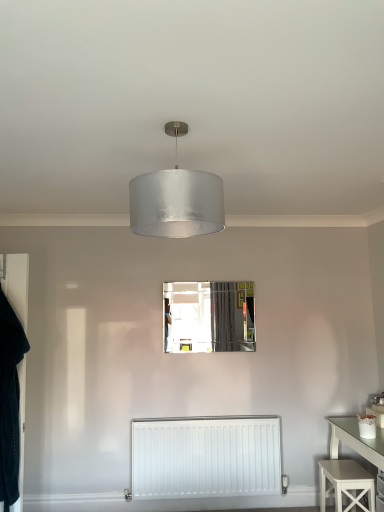
Question: Would you say white painted wood stool at lower right contains clear glass mirror at center?

Choices:
 (A) no
 (B) yes

Answer: (A)

Question: Is white painted wood stool at lower right oriented towards clear glass mirror at center?

Choices:
 (A) no
 (B) yes

Answer: (A)

Question: Would you say white painted wood stool at lower right is a long distance from clear glass mirror at center?

Choices:
 (A) yes
 (B) no

Answer: (A)

Question: Can you confirm if white painted wood stool at lower right is taller than clear glass mirror at center?

Choices:
 (A) yes
 (B) no

Answer: (B)

Question: From the image's perspective, is white painted wood stool at lower right below clear glass mirror at center?

Choices:
 (A) yes
 (B) no

Answer: (A)

Question: Considering the positions of clear glass mirror at center and satin silver shade at center in the image, is clear glass mirror at center wider or thinner than satin silver shade at center?

Choices:
 (A) wide
 (B) thin

Answer: (B)

Question: Is point (198, 342) positioned closer to the camera than point (132, 215)?

Choices:
 (A) farther
 (B) closer

Answer: (A)

Question: Relative to satin silver shade at center, is clear glass mirror at center in front or behind?

Choices:
 (A) behind
 (B) front

Answer: (A)

Question: Which is correct: clear glass mirror at center is inside satin silver shade at center, or outside of it?

Choices:
 (A) inside
 (B) outside

Answer: (B)

Question: From a real-world perspective, is satin silver shade at center above or below white matte radiator at lower center?

Choices:
 (A) below
 (B) above

Answer: (B)

Question: In terms of size, does satin silver shade at center appear bigger or smaller than white matte radiator at lower center?

Choices:
 (A) big
 (B) small

Answer: (B)

Question: Is satin silver shade at center taller or shorter than white matte radiator at lower center?

Choices:
 (A) short
 (B) tall

Answer: (A)

Question: Is satin silver shade at center in front of or behind white matte radiator at lower center in the image?

Choices:
 (A) front
 (B) behind

Answer: (A)

Question: Looking at the image, does clear glass mirror at center seem bigger or smaller compared to white painted wood stool at lower right?

Choices:
 (A) big
 (B) small

Answer: (B)

Question: In terms of width, does clear glass mirror at center look wider or thinner when compared to white painted wood stool at lower right?

Choices:
 (A) wide
 (B) thin

Answer: (B)